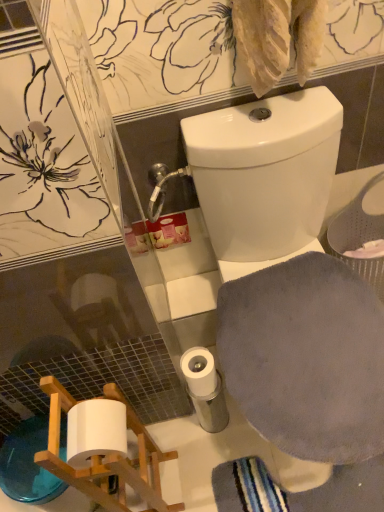
Where is `free spot above gray soft cloth at lower right (from a real-world perspective)`? The image size is (384, 512). free spot above gray soft cloth at lower right (from a real-world perspective) is located at coordinates (301, 347).